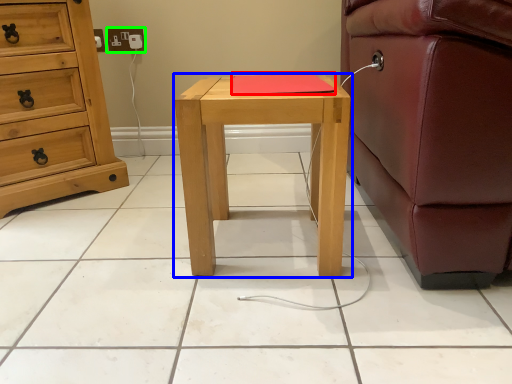
Question: Estimate the real-world distances between objects in this image. Which object is farther from pad (highlighted by a red box), nightstand (highlighted by a blue box) or electric outlet (highlighted by a green box)?

Choices:
 (A) nightstand
 (B) electric outlet

Answer: (B)